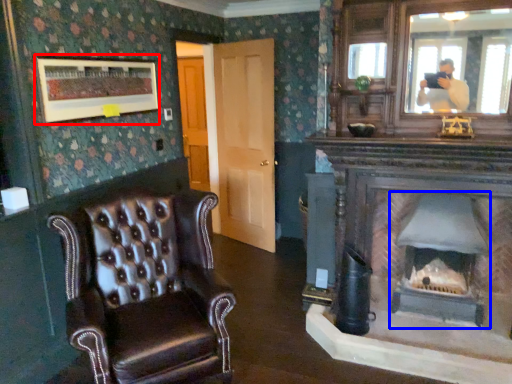
Question: Which object is further to the camera taking this photo, picture frame (highlighted by a red box) or fireplace (highlighted by a blue box)?

Choices:
 (A) picture frame
 (B) fireplace

Answer: (B)